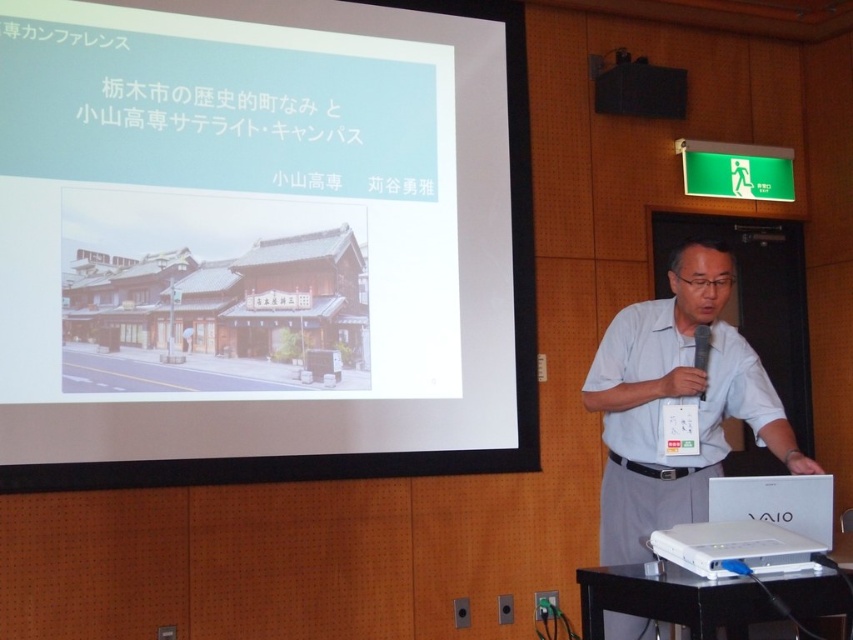
Between white matte projection screen at upper center and white matte shirt at center, which one has less height?

Standing shorter between the two is white matte shirt at center.

Between point (212, 310) and point (631, 380), which one is positioned in front?

Positioned in front is point (631, 380).

Where is `white matte projection screen at upper center`? white matte projection screen at upper center is located at coordinates (263, 241).

In the scene shown: Can you confirm if white matte projection screen at upper center is positioned to the left of white glossy laptop at upper center?

Yes, white matte projection screen at upper center is to the left of white glossy laptop at upper center.

This screenshot has width=853, height=640. Describe the element at coordinates (263, 241) in the screenshot. I see `white matte projection screen at upper center` at that location.

Is point (514, 28) more distant than point (627, 60)?

That is False.

Where is `white matte projection screen at upper center`? This screenshot has height=640, width=853. white matte projection screen at upper center is located at coordinates (263, 241).

Based on the photo, between white matte projection screen at upper center and black plastic podium at lower right, which one has more height?

Standing taller between the two is white matte projection screen at upper center.

Between white matte projection screen at upper center and black plastic podium at lower right, which one is positioned higher?

white matte projection screen at upper center is above.

The width and height of the screenshot is (853, 640). Find the location of `white matte projection screen at upper center`. white matte projection screen at upper center is located at coordinates (263, 241).